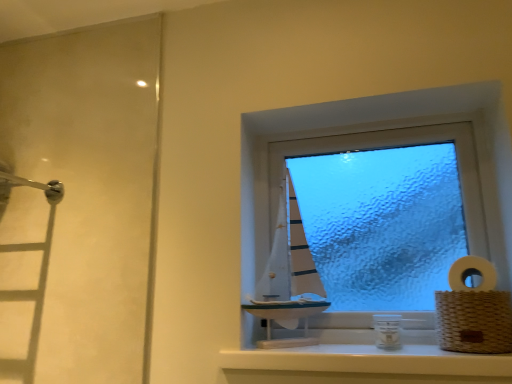
Where is `vacant region to the left of woven brown basket at right`? Image resolution: width=512 pixels, height=384 pixels. vacant region to the left of woven brown basket at right is located at coordinates (419, 344).